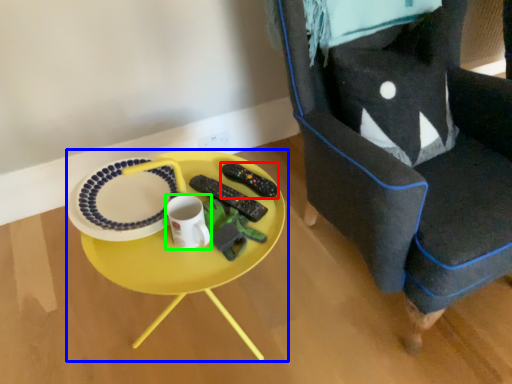
Question: Which object is the closest to the remote control (highlighted by a red box)? Choose among these: table (highlighted by a blue box) or coffee cup (highlighted by a green box).

Choices:
 (A) table
 (B) coffee cup

Answer: (A)